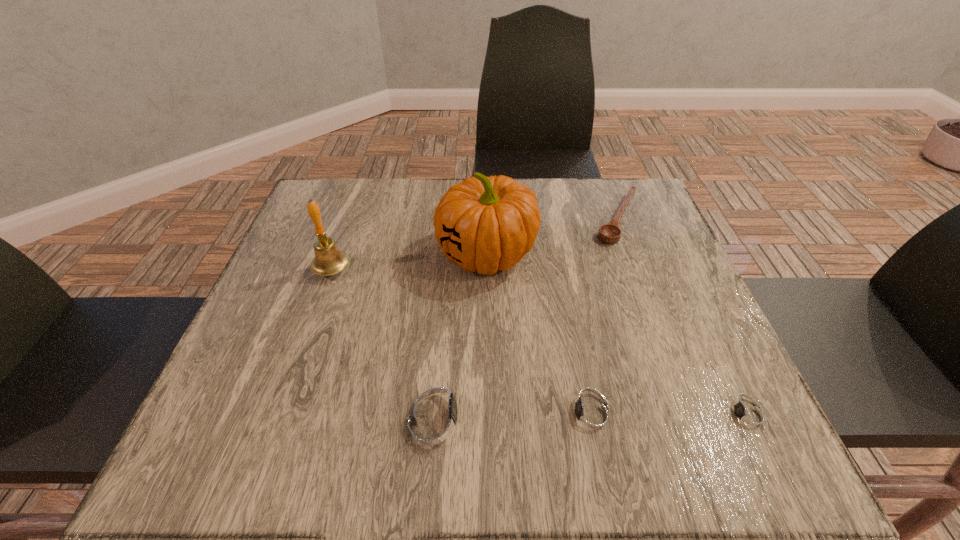
Image resolution: width=960 pixels, height=540 pixels. What are the coordinates of `wooden spoon at the far edge` in the screenshot? It's located at (610, 233).

This screenshot has height=540, width=960. I want to click on pumpkin present at the far edge, so point(484,224).

Identify the location of object at the left edge. This screenshot has width=960, height=540. (329, 260).

At what (x,y) coordinates should I click in order to perform the action: click on watch located in the right edge section of the desktop. Please return your answer as a coordinate pair (x, y). The image size is (960, 540). Looking at the image, I should click on (747, 415).

Identify the location of wooden spoon located at the right edge. (610, 233).

I want to click on object that is at the far right corner, so click(610, 233).

Identify the location of object located at the near right corner. (747, 415).

In the image, there is a desktop. Identify the location of vacant space at the far edge. (549, 181).

Identify the location of free space at the near edge of the desktop. The image size is (960, 540). (558, 386).

Identify the location of free space at the right edge. The image size is (960, 540). (667, 233).